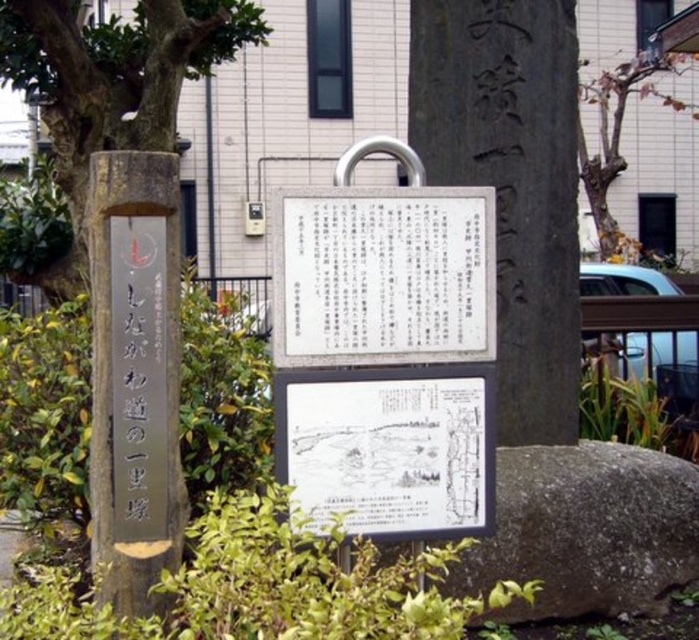
You are a tour guide holding a 10 inch ruler. You want to measure the distance between the white paper sign at center and the white paper at lower center. Can your ruler reach both ends of the distance without bending?

The distance between the white paper sign at center and the white paper at lower center is 9.26 inches. Since your ruler is 10 inches long, it can easily reach both ends of the distance without bending.

You are a tourist in a park and see the white paper sign at center and the wooden signpost at left. Which object is closer to the path that runs along the left side of the scene?

The wooden signpost at left is closer to the path that runs along the left side of the scene because it is positioned to the left of the white paper sign at center.

You are standing in front of the historical marker and need to read both the white paper sign at center and the wooden signpost at left. Which one should you look up higher to see?

The white paper sign at center is located above the wooden signpost at left, so you should look up higher to see the white paper sign at center.